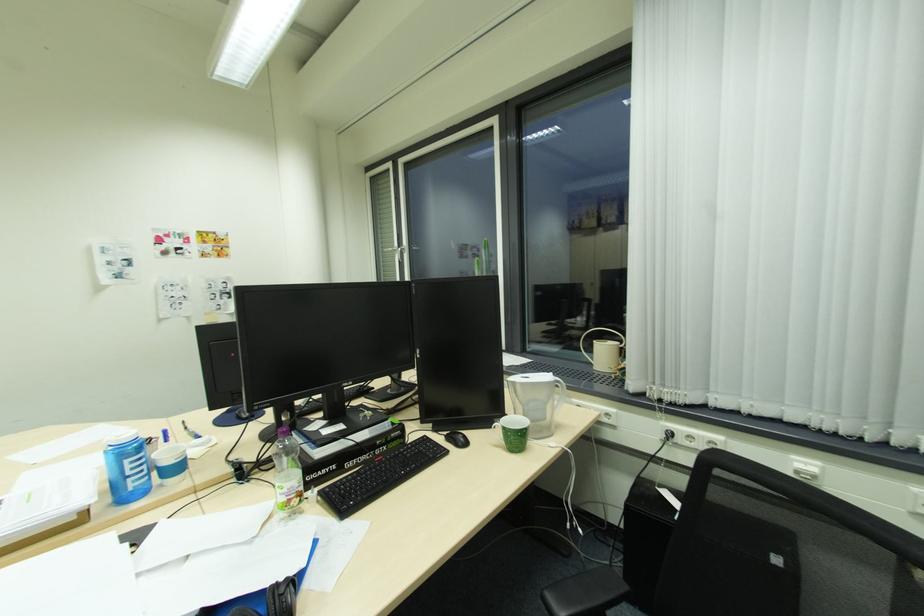
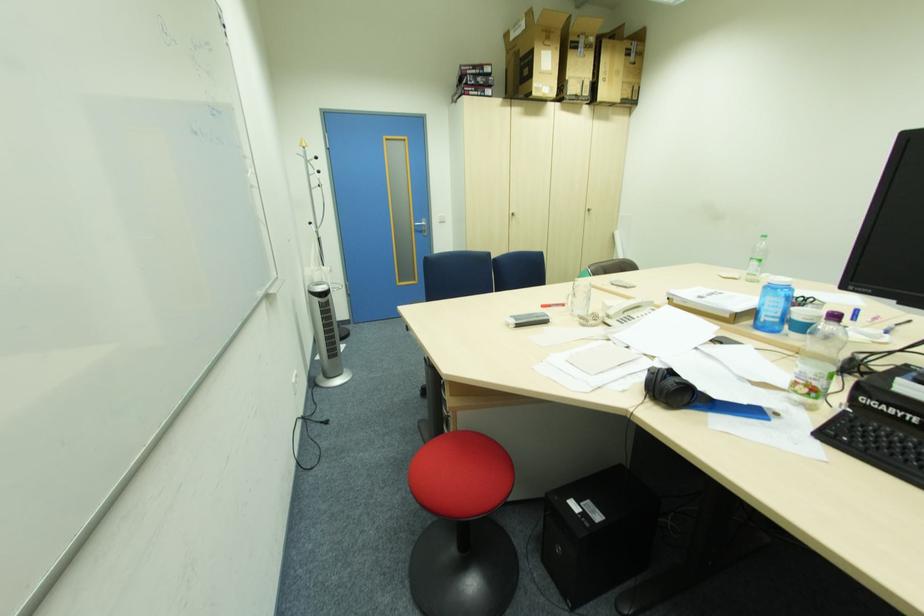
The first image is from the beginning of the video and the second image is from the end. How did the camera likely rotate when shooting the video?

The camera rotated toward left-down.